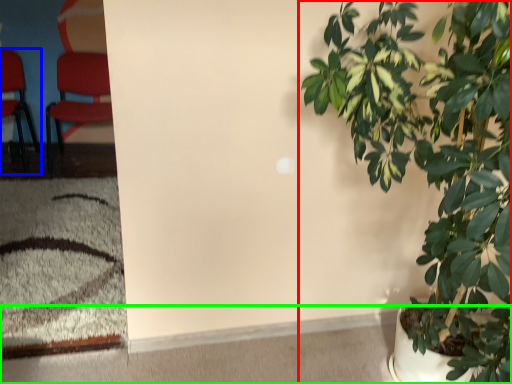
Question: Which object is positioned closest to houseplant (highlighted by a red box)? Select from chair (highlighted by a blue box) and concrete (highlighted by a green box).

Choices:
 (A) chair
 (B) concrete

Answer: (B)